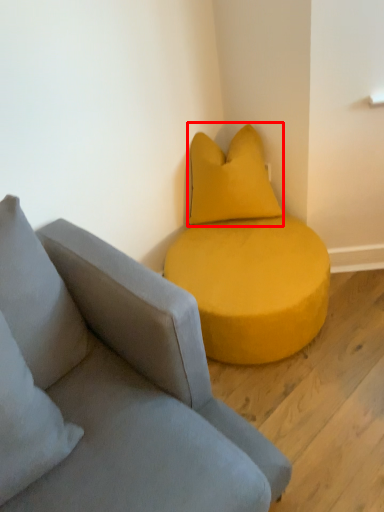
Question: From the image, what is the correct spatial relationship of pillow (annotated by the red box) in relation to studio couch?

Choices:
 (A) right
 (B) left

Answer: (B)